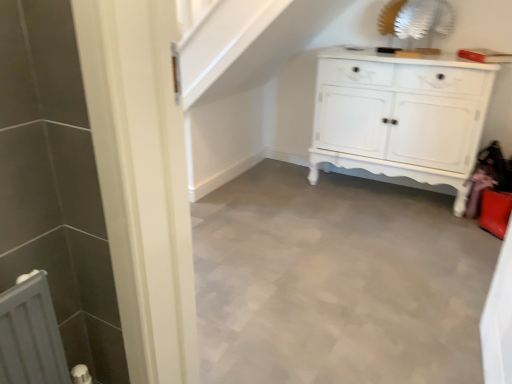
Question: Is white painted wood cabinet at center positioned beyond the bounds of smooth gray floor at center?

Choices:
 (A) yes
 (B) no

Answer: (A)

Question: Are white painted wood cabinet at center and smooth gray floor at center far apart?

Choices:
 (A) yes
 (B) no

Answer: (B)

Question: Is white painted wood cabinet at center wider than smooth gray floor at center?

Choices:
 (A) yes
 (B) no

Answer: (B)

Question: Is white painted wood cabinet at center to the right of smooth gray floor at center from the viewer's perspective?

Choices:
 (A) no
 (B) yes

Answer: (B)

Question: Considering the relative sizes of white painted wood cabinet at center and smooth gray floor at center in the image provided, is white painted wood cabinet at center taller than smooth gray floor at center?

Choices:
 (A) yes
 (B) no

Answer: (A)

Question: Relative to smooth gray floor at center, is white matte radiator at lower left in front or behind?

Choices:
 (A) front
 (B) behind

Answer: (A)

Question: From a real-world perspective, relative to smooth gray floor at center, is white matte radiator at lower left vertically above or below?

Choices:
 (A) above
 (B) below

Answer: (A)

Question: Is white matte radiator at lower left wider or thinner than smooth gray floor at center?

Choices:
 (A) thin
 (B) wide

Answer: (A)

Question: Do you think white matte radiator at lower left is within smooth gray floor at center, or outside of it?

Choices:
 (A) outside
 (B) inside

Answer: (A)

Question: In terms of height, does smooth gray floor at center look taller or shorter compared to white painted wood cabinet at center?

Choices:
 (A) tall
 (B) short

Answer: (B)

Question: From the image's perspective, is smooth gray floor at center positioned above or below white painted wood cabinet at center?

Choices:
 (A) above
 (B) below

Answer: (B)

Question: Considering the relative positions of smooth gray floor at center and white painted wood cabinet at center in the image provided, is smooth gray floor at center to the left or to the right of white painted wood cabinet at center?

Choices:
 (A) right
 (B) left

Answer: (B)

Question: Is smooth gray floor at center inside or outside of white painted wood cabinet at center?

Choices:
 (A) outside
 (B) inside

Answer: (A)

Question: From a real-world perspective, is white painted wood cabinet at center physically located above or below white matte radiator at lower left?

Choices:
 (A) above
 (B) below

Answer: (A)

Question: Considering the positions of white painted wood cabinet at center and white matte radiator at lower left in the image, is white painted wood cabinet at center taller or shorter than white matte radiator at lower left?

Choices:
 (A) tall
 (B) short

Answer: (A)